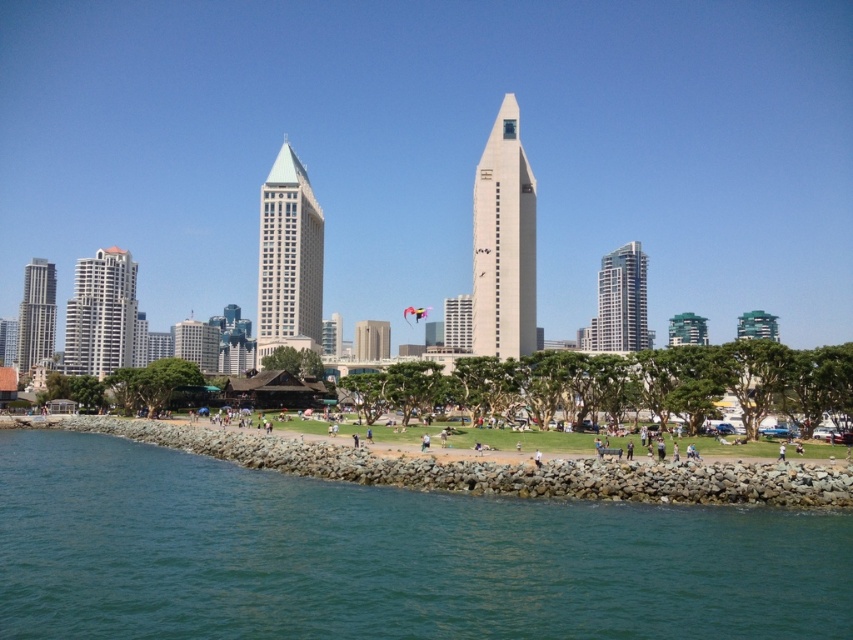
You are a photographer planning to take a wide shot of the waterfront scene. You want to ensure both the green water at lower left and the smooth glass skyscraper at right are clearly visible. Given their sizes, which object will occupy more of the frame?

The green water at lower left is larger in size than the smooth glass skyscraper at right, so it will occupy more of the frame in the wide shot.

From the picture: You are standing at the point marked by point (102, 314) in the image. What is the nearest object to you?

The nearest object to you is the matte glass building at left marked by point (102, 314).

You are a photographer wanting to capture both the green water at lower left and the smooth glass skyscraper at right in the same frame. Based on their heights, which object should you position closer to the front of your photo to ensure both are visible?

The green water at lower left is shorter than the smooth glass skyscraper at right, so you should position the green water at lower left closer to the front of the photo to ensure both are visible.